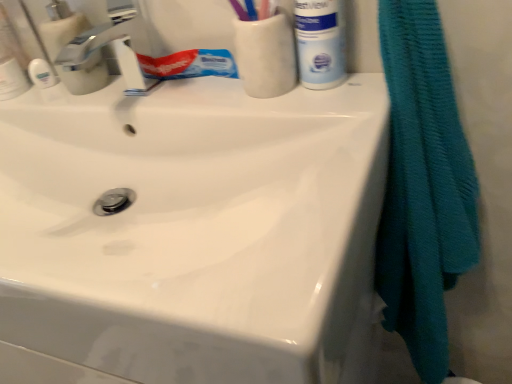
Question: Does point (334, 84) appear closer or farther from the camera than point (422, 86)?

Choices:
 (A) closer
 (B) farther

Answer: (B)

Question: From their relative heights in the image, would you say white matte mouthwash at upper right is taller or shorter than teal textured towel at right?

Choices:
 (A) tall
 (B) short

Answer: (B)

Question: In terms of width, does white matte mouthwash at upper right look wider or thinner when compared to teal textured towel at right?

Choices:
 (A) wide
 (B) thin

Answer: (B)

Question: Which is correct: teal textured towel at right is inside white matte mouthwash at upper right, or outside of it?

Choices:
 (A) inside
 (B) outside

Answer: (B)

Question: Is point (385, 259) positioned closer to the camera than point (338, 44)?

Choices:
 (A) farther
 (B) closer

Answer: (A)

Question: Would you say teal textured towel at right is to the left or to the right of white matte mouthwash at upper right in the picture?

Choices:
 (A) right
 (B) left

Answer: (A)

Question: From the image's perspective, is teal textured towel at right positioned above or below white matte mouthwash at upper right?

Choices:
 (A) below
 (B) above

Answer: (A)